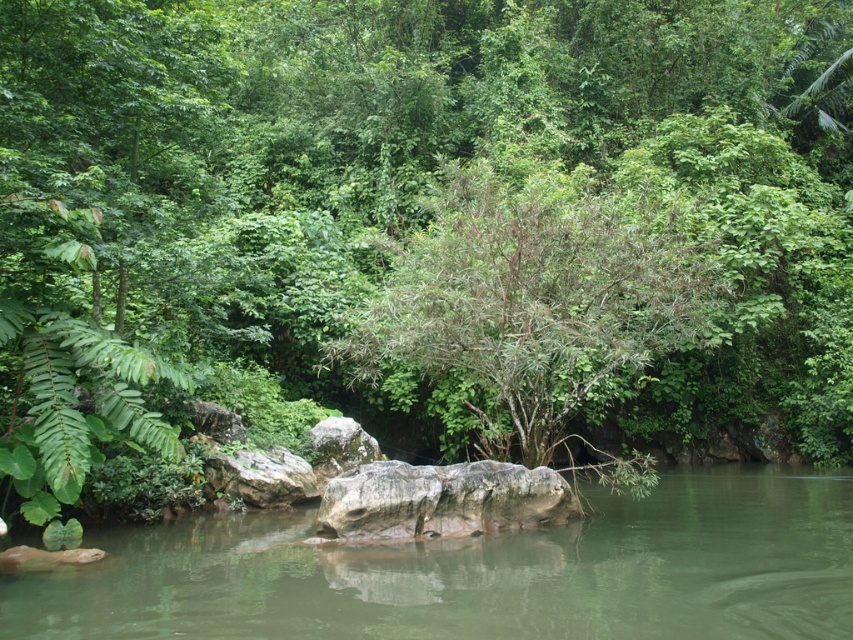
You are standing at the edge of the water in this natural setting. You see the green smooth water at center and the gray rough boulder at center. Which object is located higher in the scene?

The gray rough boulder at center is higher than the green smooth water at center because the green smooth water at center is below the gray rough boulder at center.